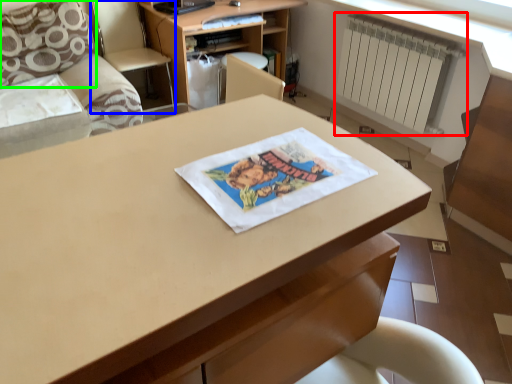
Question: Based on their relative distances, which object is nearer to radiator (highlighted by a red box)? Choose from armchair (highlighted by a blue box) and pillow (highlighted by a green box).

Choices:
 (A) armchair
 (B) pillow

Answer: (A)